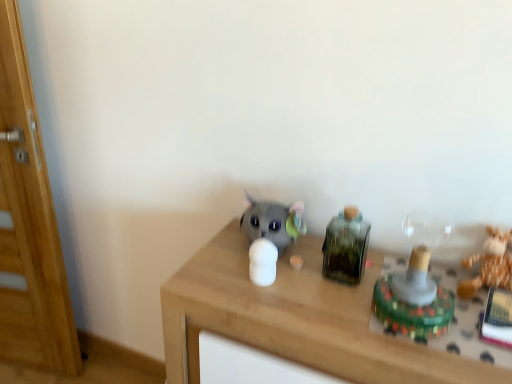
Find the location of `vacant area that lies in front of translucent plastic toy at right, the third toy when ordered from left to right`. vacant area that lies in front of translucent plastic toy at right, the third toy when ordered from left to right is located at coordinates pyautogui.click(x=436, y=359).